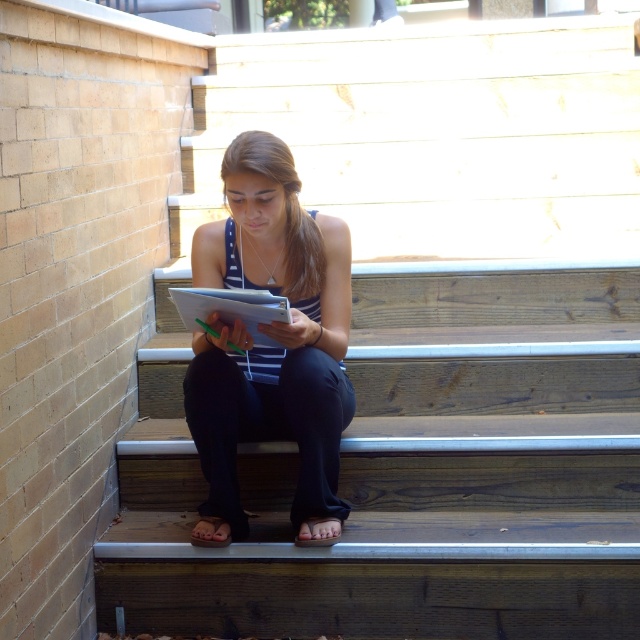
You are a student who needs to place both the matte black notebook at center and the white paper at center on a desk that is 6 inches wide. Can both items fit side by side on the desk without overlapping?

The matte black notebook at center is 6.46 inches away from white paper at center, which means the total width required for both items is 6.46 inches. Since the desk is only 6 inches wide, they cannot fit side by side without overlapping.

You are a student who wants to write a long essay. You have a matte black notebook at center and a white paper at center. Which object would you choose to use for writing more lines?

The matte black notebook at center is much taller than the white paper at center, so it can accommodate more lines for writing the long essay.